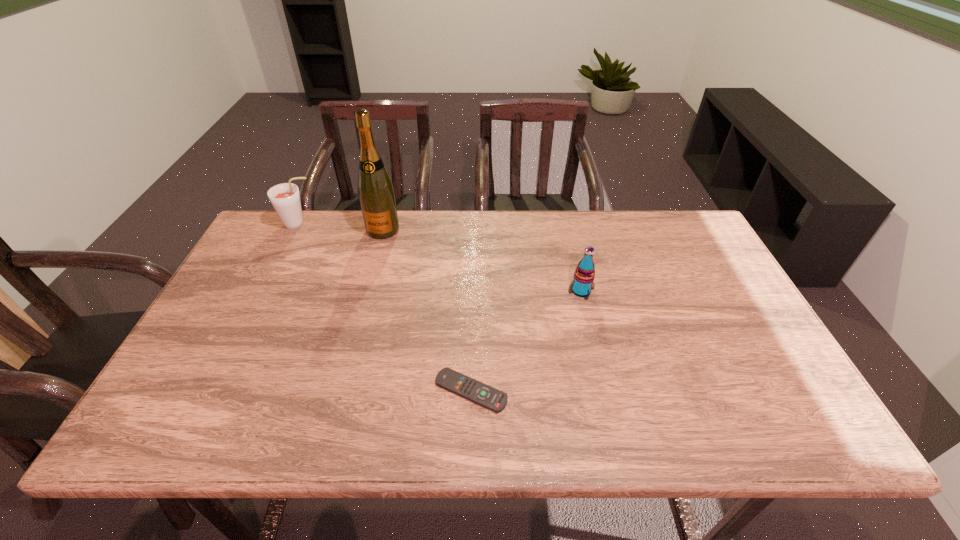
The image size is (960, 540). What are the coordinates of `free location located 0.360m on the right of the nearest object` in the screenshot? It's located at (x=666, y=391).

Find the location of a particular element. The image size is (960, 540). wine bottle that is at the far edge is located at coordinates (x=376, y=193).

At what (x,y) coordinates should I click in order to perform the action: click on root beer that is positioned at the far edge. Please return your answer as a coordinate pair (x, y). The image size is (960, 540). Looking at the image, I should click on (285, 198).

Find the location of a particular element. This screenshot has height=540, width=960. object that is at the near edge is located at coordinates (475, 391).

Identify the location of object present at the left edge. (285, 198).

Locate an element on the screen. Image resolution: width=960 pixels, height=540 pixels. object positioned at the far left corner is located at coordinates click(x=285, y=198).

Where is `vacant space at the far edge of the desktop`? Image resolution: width=960 pixels, height=540 pixels. vacant space at the far edge of the desktop is located at coordinates (417, 221).

In order to click on vacant space at the near edge in this screenshot , I will do `click(621, 422)`.

Image resolution: width=960 pixels, height=540 pixels. What are the coordinates of `free region at the left edge of the desktop` in the screenshot? It's located at (241, 350).

In the image, there is a desktop. Where is `free space at the right edge`? This screenshot has height=540, width=960. free space at the right edge is located at coordinates (712, 258).